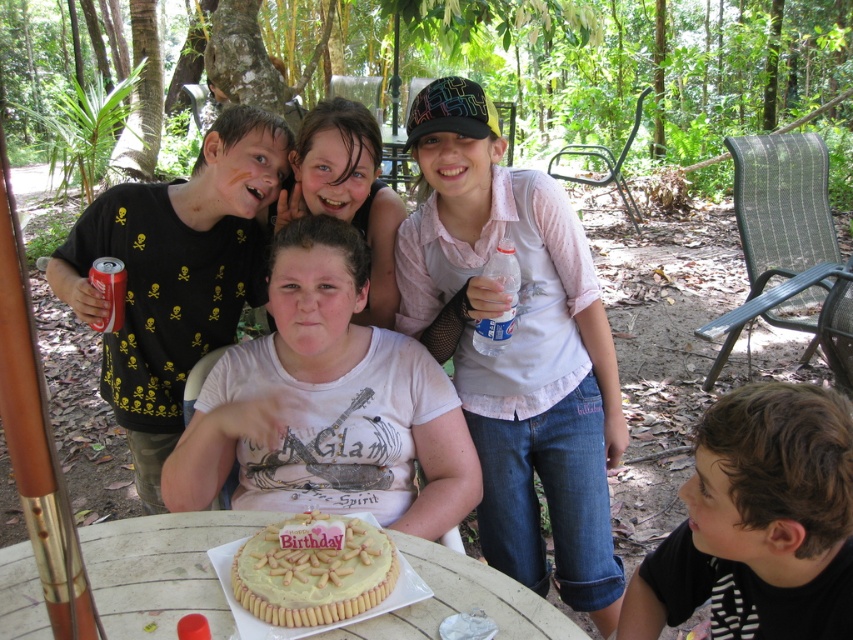
Is white matte shirt at center above matte white shirt at center?

No, white matte shirt at center is not above matte white shirt at center.

Consider the image. Does white matte shirt at center have a lesser height compared to matte white shirt at center?

In fact, white matte shirt at center may be taller than matte white shirt at center.

Where is `white matte shirt at center`? This screenshot has width=853, height=640. white matte shirt at center is located at coordinates (328, 404).

You are a GUI agent. You are given a task and a screenshot of the screen. Output one action in this format:
    pyautogui.click(x=<x>, y=<y>)
    Task: Click on the white matte shirt at center
    
    Given the screenshot: What is the action you would take?
    pyautogui.click(x=328, y=404)

Which of these two, black matte hair at lower right or wooden round table at center, stands shorter?

wooden round table at center

Does black matte hair at lower right appear under wooden round table at center?

No, black matte hair at lower right is not below wooden round table at center.

The width and height of the screenshot is (853, 640). What do you see at coordinates (758, 522) in the screenshot?
I see `black matte hair at lower right` at bounding box center [758, 522].

Where is `black matte hair at lower right`? black matte hair at lower right is located at coordinates (758, 522).

Does matte white cake at center have a larger size compared to matte white shirt at center?

Indeed, matte white cake at center has a larger size compared to matte white shirt at center.

Between matte white cake at center and matte white shirt at center, which one has less height?

Standing shorter between the two is matte white shirt at center.

Is point (576, 580) closer to camera compared to point (340, 176)?

No.

The image size is (853, 640). Find the location of `matte white cake at center`. matte white cake at center is located at coordinates (549, 422).